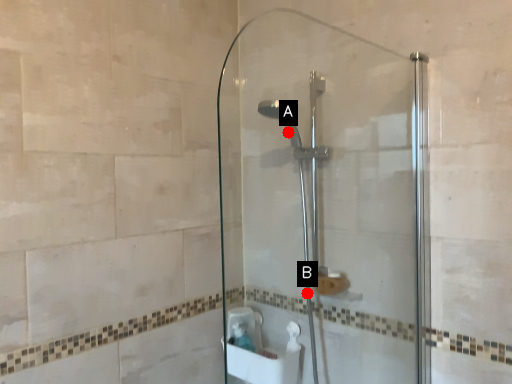
Question: Two points are circled on the image, labeled by A and B beside each circle. Among these points, which one is farthest from the camera?

Choices:
 (A) A is further
 (B) B is further

Answer: (A)